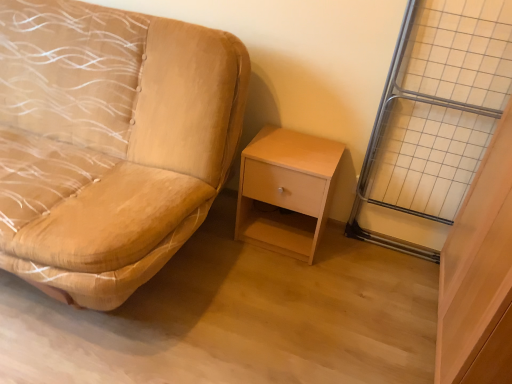
This screenshot has height=384, width=512. I want to click on vacant area situated below metal grid at right (from a real-world perspective), so click(392, 250).